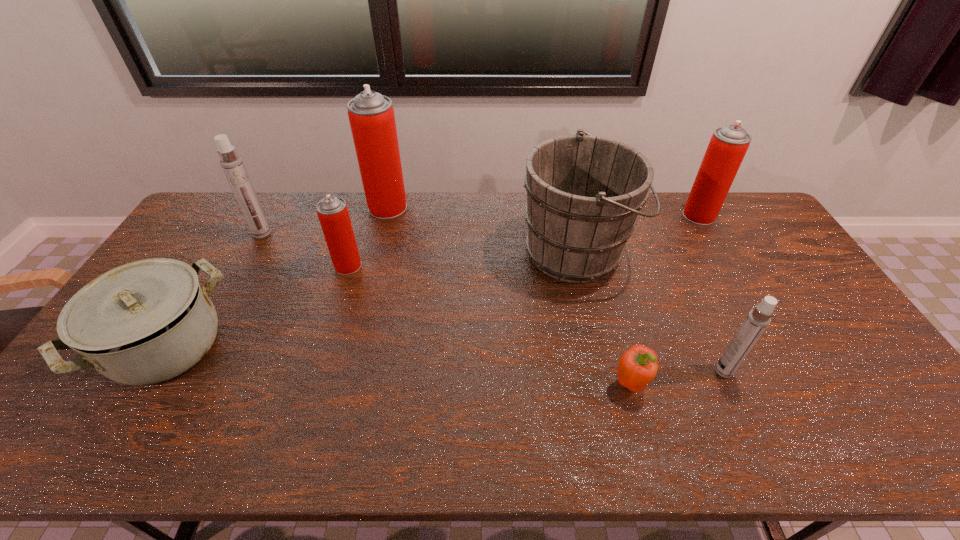
You are a GUI agent. You are given a task and a screenshot of the screen. Output one action in this format:
    pyautogui.click(x=<x>, y=<y>)
    Task: Click on the biggest red aerosol can
    The height and width of the screenshot is (540, 960).
    Given the screenshot: What is the action you would take?
    pyautogui.click(x=371, y=115)

The width and height of the screenshot is (960, 540). I want to click on the tallest object, so click(371, 115).

Where is `the second biggest red aerosol can`? the second biggest red aerosol can is located at coordinates (728, 145).

This screenshot has width=960, height=540. Find the location of `the rightmost red aerosol can`. the rightmost red aerosol can is located at coordinates (728, 145).

You are a GUI agent. You are given a task and a screenshot of the screen. Output one action in this format:
    pyautogui.click(x=<x>, y=<y>)
    Task: Click on the third farthest aerosol can
    Image resolution: width=960 pixels, height=540 pixels.
    Given the screenshot: What is the action you would take?
    pyautogui.click(x=231, y=163)

Locate an element on the screen. The width and height of the screenshot is (960, 540). the farther white aerosol can is located at coordinates (231, 163).

This screenshot has height=540, width=960. Find the location of `bucket`. bucket is located at coordinates (584, 192).

The height and width of the screenshot is (540, 960). I want to click on the nearest red aerosol can, so click(x=333, y=214).

Image resolution: width=960 pixels, height=540 pixels. In order to click on the smallest red aerosol can in this screenshot , I will do `click(333, 214)`.

Image resolution: width=960 pixels, height=540 pixels. What are the coordinates of `the smaller white aerosol can` in the screenshot? It's located at (757, 320).